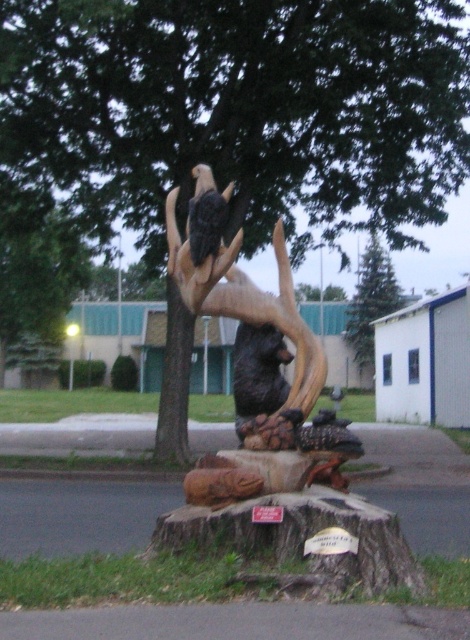
Question: Is wooden sculpture at center to the right of dark brown wood eagle at upper center from the viewer's perspective?

Choices:
 (A) yes
 (B) no

Answer: (B)

Question: Which is nearer to the dark brown wood eagle at upper center?

Choices:
 (A) dark brown wood bear at center
 (B) green textured pine tree at upper center

Answer: (A)

Question: Which of these objects is positioned farthest from the green textured pine tree at upper center?

Choices:
 (A) wooden sculpture at center
 (B) dark brown wood bear at center
 (C) dark brown wood eagle at upper center
 (D) wooden bear statue at center

Answer: (C)

Question: Can you confirm if wooden sculpture at center is wider than dark brown wood eagle at upper center?

Choices:
 (A) yes
 (B) no

Answer: (A)

Question: Which point is farther to the camera?

Choices:
 (A) wooden bear statue at center
 (B) green textured pine tree at upper center
 (C) dark brown wood bear at center
 (D) wooden sculpture at center

Answer: (B)

Question: Can you confirm if wooden sculpture at center is positioned to the right of dark brown wood bear at center?

Choices:
 (A) yes
 (B) no

Answer: (B)